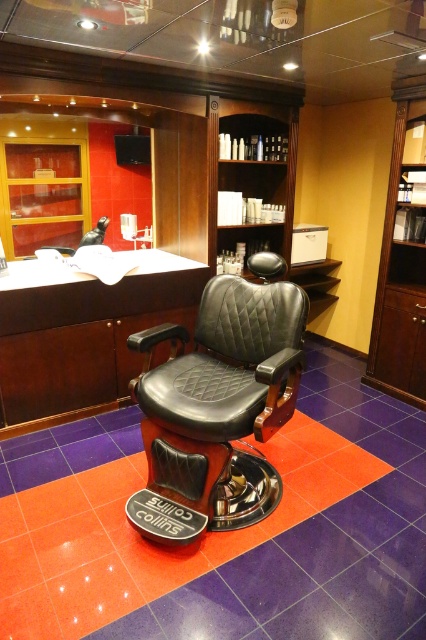
Question: Can you confirm if black leather swivel chair at center is smaller than wooden bookshelf at right?

Choices:
 (A) yes
 (B) no

Answer: (B)

Question: Can you confirm if black leather swivel chair at center is positioned below wooden bookshelf at right?

Choices:
 (A) no
 (B) yes

Answer: (B)

Question: Which point is closer to the camera taking this photo?

Choices:
 (A) (247, 128)
 (B) (379, 282)
 (C) (172, 332)

Answer: (C)

Question: Estimate the real-world distances between objects in this image. Which object is farther from the woodenmaterial/texturebookshelf at upper center?

Choices:
 (A) wooden bookshelf at right
 (B) black leather swivel chair at center

Answer: (B)

Question: Can you confirm if black leather swivel chair at center is wider than woodenmaterial/texturebookshelf at upper center?

Choices:
 (A) no
 (B) yes

Answer: (B)

Question: Which is nearer to the woodenmaterial/texturebookshelf at upper center?

Choices:
 (A) black leather swivel chair at center
 (B) wooden bookshelf at right

Answer: (B)